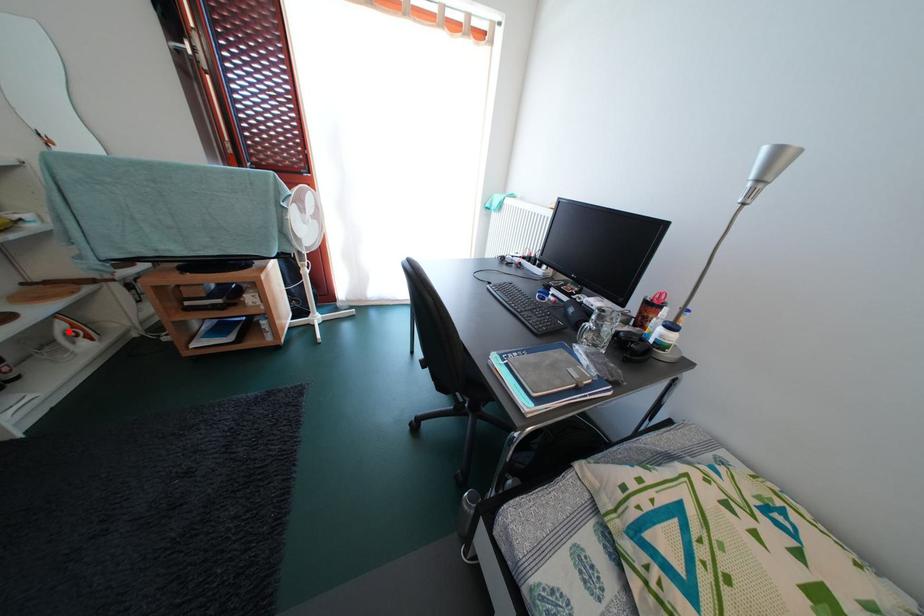
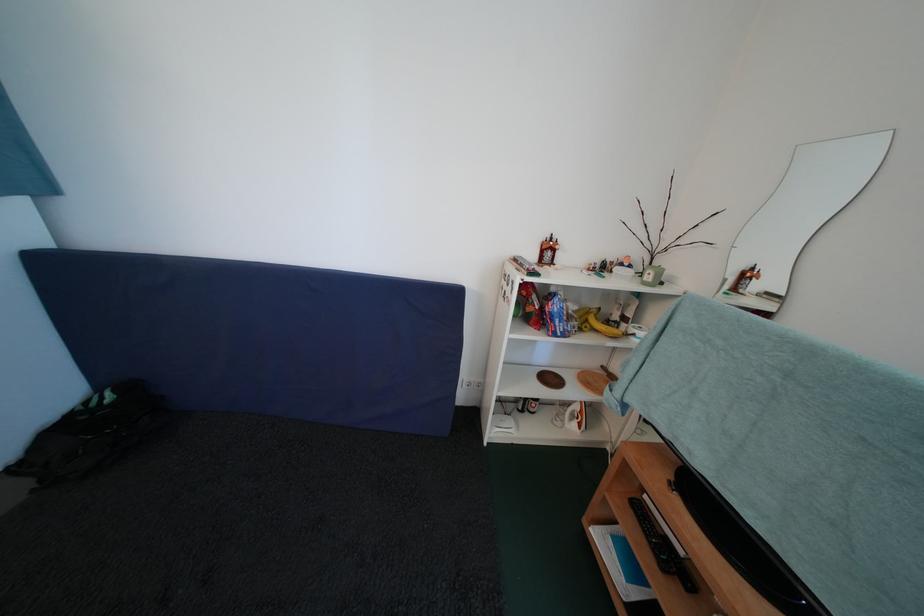
Where in the second image is the point corresponding to the highlighted location from the first image?

(584, 411)